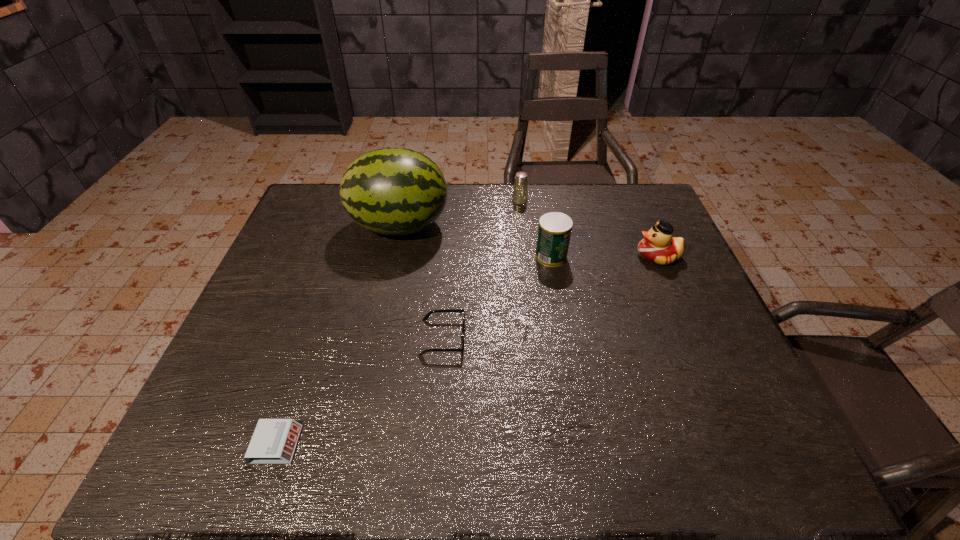
Where is `blank space that satisfies the following two spatial constraints: 1. at the stem end of the watermelon; 2. on the back side of the can`? blank space that satisfies the following two spatial constraints: 1. at the stem end of the watermelon; 2. on the back side of the can is located at coordinates (394, 256).

Locate an element on the screen. Image resolution: width=960 pixels, height=540 pixels. free space in the image that satisfies the following two spatial constraints: 1. on the front side of the saltshaker; 2. on the left side of the fifth object from left to right is located at coordinates (526, 256).